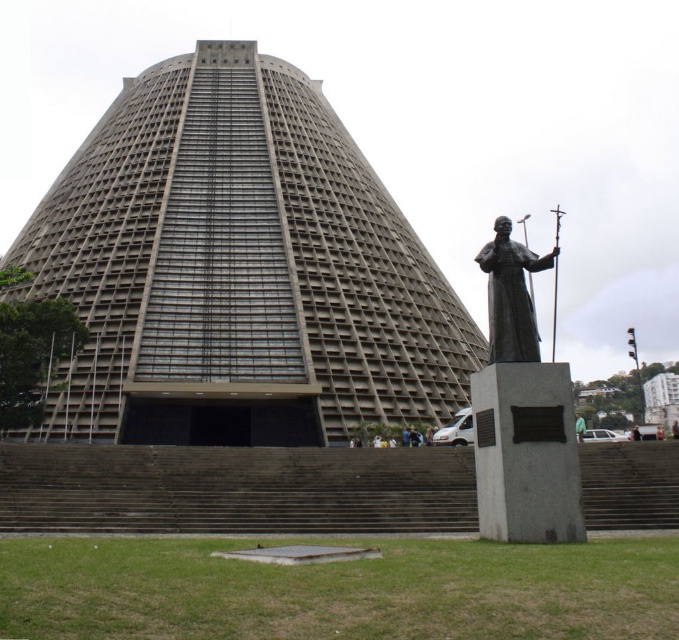
Question: Estimate the real-world distances between objects in this image. Which object is farther from the bronze statue at center?

Choices:
 (A) dark brown statue at center
 (B) gray concrete tower at center
 (C) green fabric jacket at lower right
 (D) light brown wooden statue at center

Answer: (B)

Question: Among these points, which one is nearest to the camera?

Choices:
 (A) (528, 499)
 (B) (301, 397)
 (C) (483, 257)

Answer: (A)

Question: Which point is closer to the camera taking this photo?

Choices:
 (A) (504, 356)
 (B) (498, 480)

Answer: (B)

Question: Does green fabric jacket at lower right have a larger size compared to dark brown statue at center?

Choices:
 (A) yes
 (B) no

Answer: (A)

Question: Is polished bronze statue at lower right smaller than dark brown statue at center?

Choices:
 (A) yes
 (B) no

Answer: (A)

Question: Is polished bronze statue at lower right further to the viewer compared to dark brown statue at center?

Choices:
 (A) no
 (B) yes

Answer: (A)